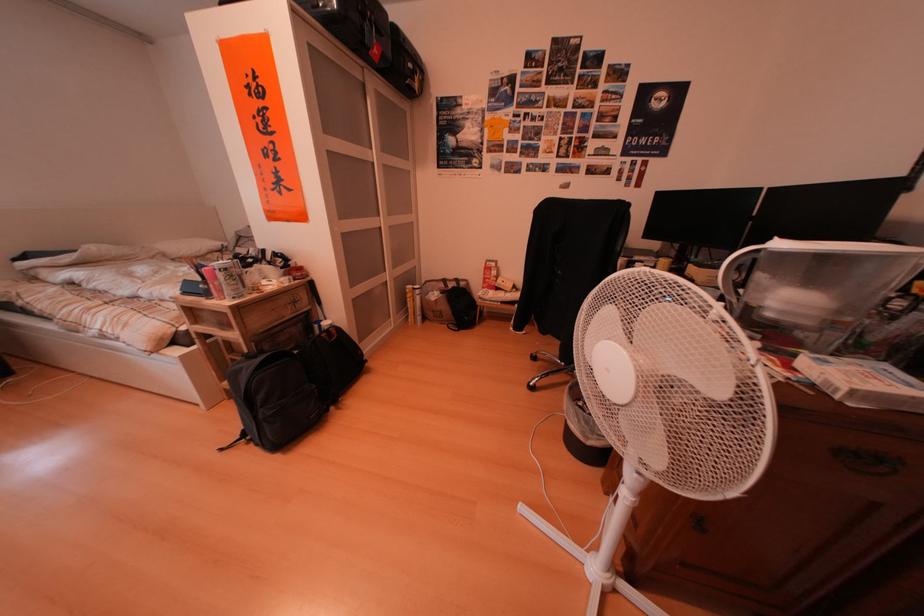
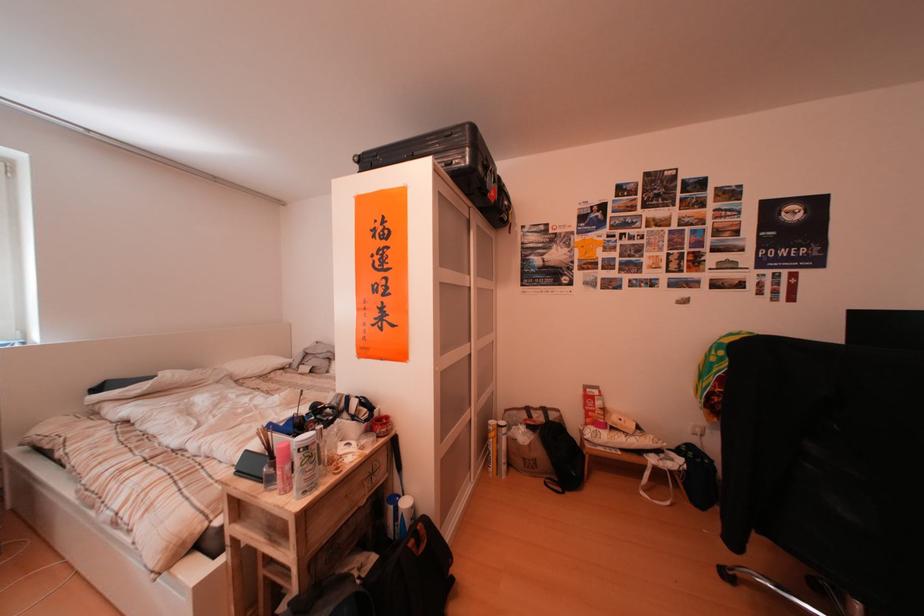
In the second image, find the point that corresponds to (338,344) in the first image.

(428, 556)